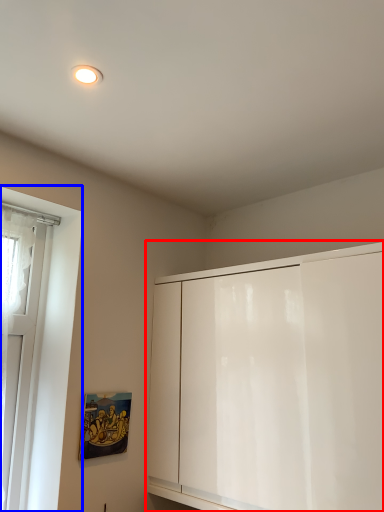
Question: Which point is further to the camera, cabinetry (highlighted by a red box) or window (highlighted by a blue box)?

Choices:
 (A) cabinetry
 (B) window

Answer: (B)